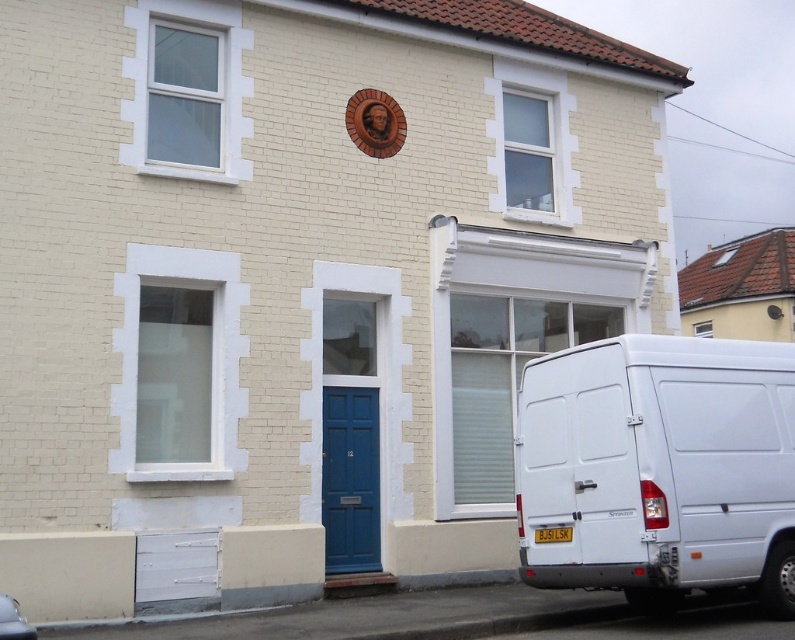
Question: Is white matte van at lower right above blue painted wood door at center?

Choices:
 (A) yes
 (B) no

Answer: (A)

Question: Is white matte van at lower right thinner than blue painted wood door at center?

Choices:
 (A) yes
 (B) no

Answer: (B)

Question: Is white matte van at lower right thinner than blue painted wood door at center?

Choices:
 (A) yes
 (B) no

Answer: (B)

Question: Among these points, which one is nearest to the camera?

Choices:
 (A) (369, 417)
 (B) (528, 472)

Answer: (B)

Question: Which object appears closest to the camera in this image?

Choices:
 (A) blue painted wood door at center
 (B) white matte van at lower right

Answer: (B)